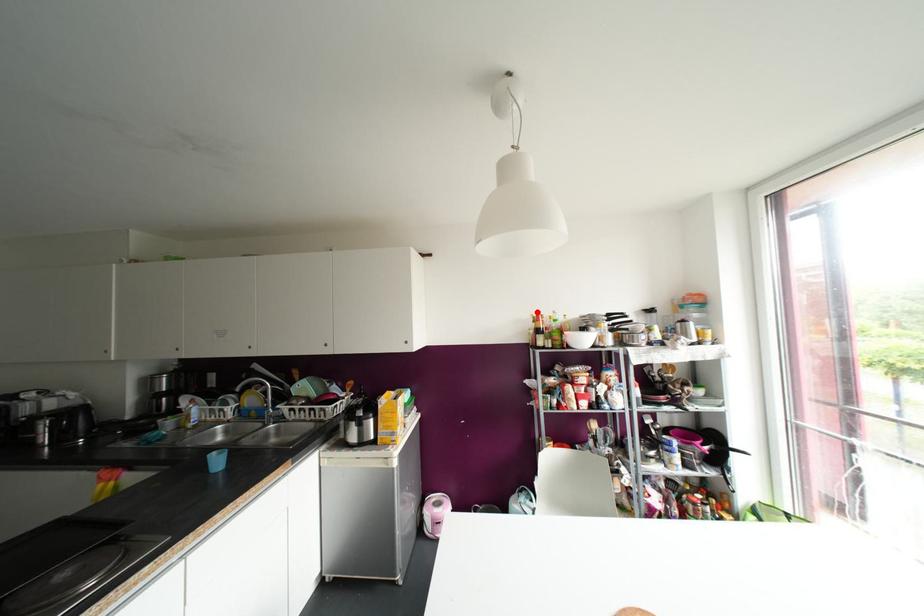
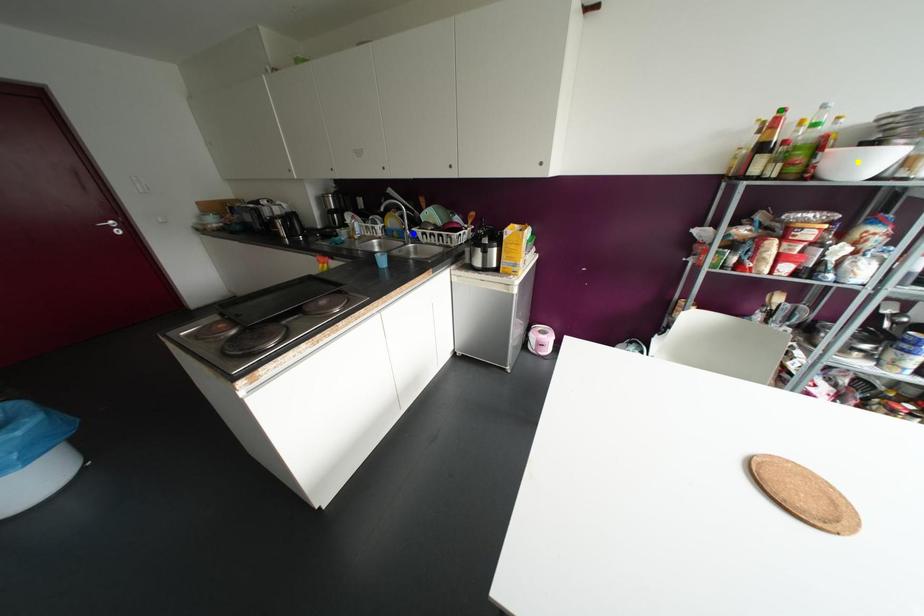
Question: I am providing you with two images of the same scene from different viewpoints. A red point is marked on the first image. You are given multiple points on the second image. In image 2, which mark is for the same physical point as the one in image 1?

Choices:
 (A) green point
 (B) blue point
 (C) yellow point

Answer: (A)